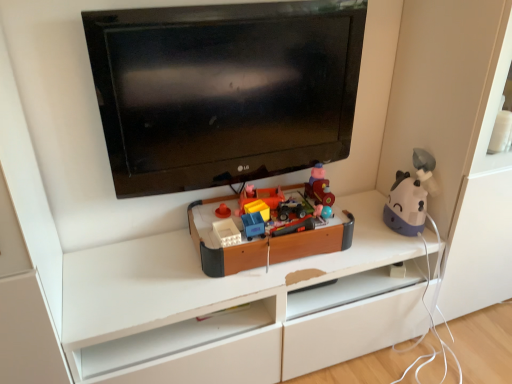
Question: Is black glossy tv at upper center next to wooden toy box at center, which is the third toy from right to left, and touching it?

Choices:
 (A) yes
 (B) no

Answer: (B)

Question: Does black glossy tv at upper center have a larger size compared to wooden toy box at center, arranged as the first toy when viewed from the left?

Choices:
 (A) yes
 (B) no

Answer: (A)

Question: From the image's perspective, is black glossy tv at upper center over wooden toy box at center, arranged as the first toy when viewed from the left?

Choices:
 (A) no
 (B) yes

Answer: (B)

Question: Is black glossy tv at upper center closer to camera compared to wooden toy box at center, arranged as the first toy when viewed from the left?

Choices:
 (A) no
 (B) yes

Answer: (B)

Question: Is wooden toy box at center, arranged as the first toy when viewed from the left, located within black glossy tv at upper center?

Choices:
 (A) yes
 (B) no

Answer: (B)

Question: Is wooden toy train at center, the second toy viewed from the left, inside the boundaries of purple matte humidifier at right, which ranks as the 3th toy in left-to-right order, or outside?

Choices:
 (A) outside
 (B) inside

Answer: (A)

Question: Is wooden toy train at center, the second toy viewed from the left, in front of or behind purple matte humidifier at right, which ranks as the 3th toy in left-to-right order, in the image?

Choices:
 (A) front
 (B) behind

Answer: (B)

Question: Is wooden toy train at center, the second toy viewed from the left, taller or shorter than purple matte humidifier at right, which appears as the first toy when viewed from the right?

Choices:
 (A) tall
 (B) short

Answer: (B)

Question: Is point (315, 200) positioned closer to the camera than point (415, 180)?

Choices:
 (A) closer
 (B) farther

Answer: (B)

Question: From a real-world perspective, is wooden toy train at center, which ranks as the second toy in right-to-left order, physically located above or below black glossy tv at upper center?

Choices:
 (A) below
 (B) above

Answer: (A)

Question: Based on their sizes in the image, would you say wooden toy train at center, which ranks as the second toy in right-to-left order, is bigger or smaller than black glossy tv at upper center?

Choices:
 (A) big
 (B) small

Answer: (B)

Question: Do you think wooden toy train at center, which ranks as the second toy in right-to-left order, is within black glossy tv at upper center, or outside of it?

Choices:
 (A) outside
 (B) inside

Answer: (A)

Question: In terms of width, does wooden toy train at center, which ranks as the second toy in right-to-left order, look wider or thinner when compared to black glossy tv at upper center?

Choices:
 (A) wide
 (B) thin

Answer: (A)

Question: Is purple matte humidifier at right, which appears as the first toy when viewed from the right, taller or shorter than wooden toy box at center, arranged as the first toy when viewed from the left?

Choices:
 (A) short
 (B) tall

Answer: (B)

Question: Visually, is purple matte humidifier at right, which ranks as the 3th toy in left-to-right order, positioned to the left or to the right of wooden toy box at center, arranged as the first toy when viewed from the left?

Choices:
 (A) left
 (B) right

Answer: (B)